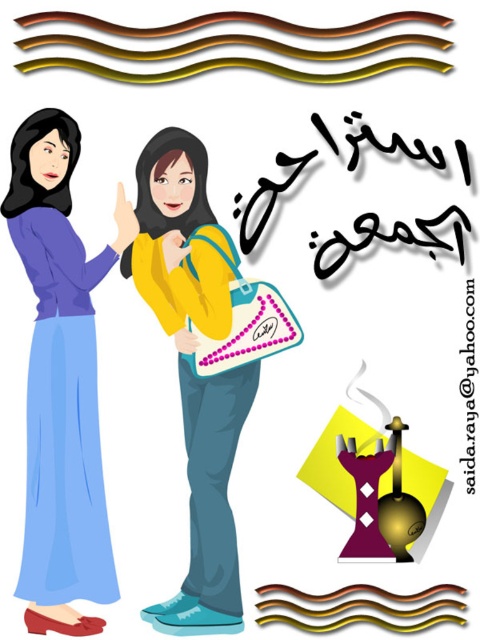
Who is more distant from viewer, (127, 218) or (191, 346)?

Point (127, 218)

Between white matte hand at center and matte blue handbag at center, which one appears on the right side from the viewer's perspective?

matte blue handbag at center is more to the right.

Who is more forward, (118,214) or (195,349)?

Point (195,349) is in front.

I want to click on white matte hand at center, so click(123, 221).

Is yellow matte backpack at center below white matte hand at center?

Correct, yellow matte backpack at center is located below white matte hand at center.

Describe the element at coordinates (210, 496) in the screenshot. The height and width of the screenshot is (640, 480). I see `yellow matte backpack at center` at that location.

Who is more distant from viewer, (202,588) or (120,244)?

Positioned behind is point (202,588).

This screenshot has width=480, height=640. I want to click on yellow matte backpack at center, so click(x=210, y=496).

The width and height of the screenshot is (480, 640). Identify the location of matte purple dress at left. (59, 387).

Which is in front, point (80, 285) or point (173, 330)?

Point (80, 285) is in front.

Identify the location of matte purple dress at left. The image size is (480, 640). (59, 387).